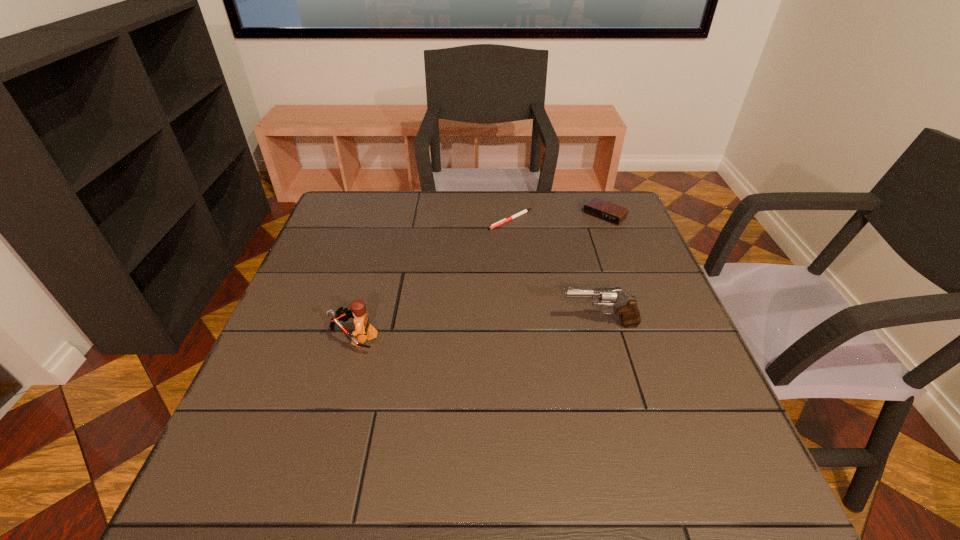
In order to click on free spot between the alarm clock and the leftmost object in this screenshot , I will do `click(480, 276)`.

I want to click on blank region between the alarm clock and the shortest object, so click(x=558, y=218).

Locate an element on the screen. The height and width of the screenshot is (540, 960). unoccupied area between the pistol and the third tallest object is located at coordinates [602, 270].

I want to click on vacant region between the second shortest object and the shortest object, so click(x=558, y=218).

Find the location of `empty space between the pistol and the pen`. empty space between the pistol and the pen is located at coordinates (556, 272).

You are a GUI agent. You are given a task and a screenshot of the screen. Output one action in this format:
    pyautogui.click(x=<x>, y=<y>)
    Task: Click on the free spot between the pistol and the alarm clock
    This screenshot has width=960, height=540.
    Given the screenshot: What is the action you would take?
    pyautogui.click(x=602, y=270)

Where is `vacant area that lies between the leftmost object and the alarm clock`? vacant area that lies between the leftmost object and the alarm clock is located at coordinates (480, 276).

This screenshot has height=540, width=960. Find the location of `object that can be found as the closest to the pistol`. object that can be found as the closest to the pistol is located at coordinates (505, 220).

Identify the location of object that is the closest to the alarm clock. The height and width of the screenshot is (540, 960). 505,220.